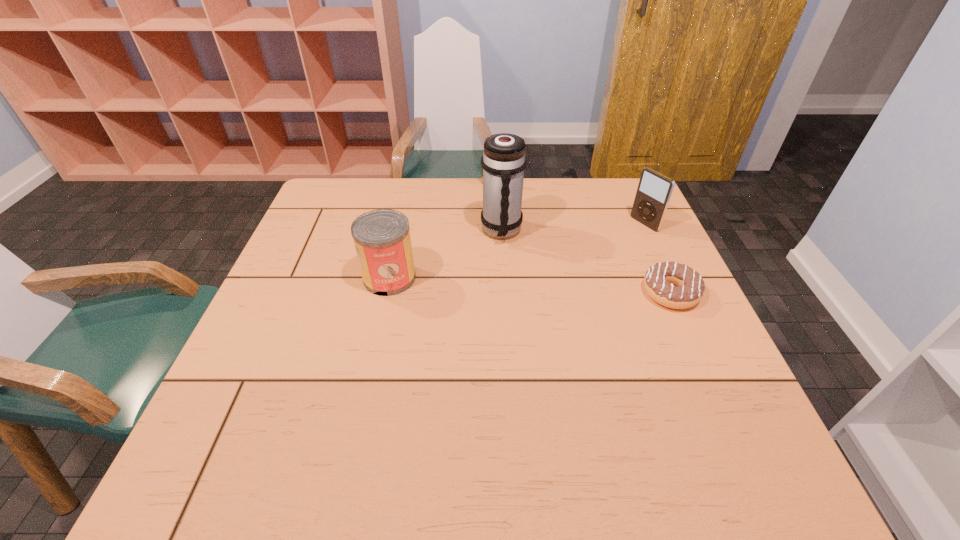
At what (x,y) coordinates should I click in order to perform the action: click on free space on the desktop that is between the can and the doughnut and is positioned on the side with the handle of the tallest object. Please return your answer as a coordinate pair (x, y). The width and height of the screenshot is (960, 540). Looking at the image, I should click on (525, 285).

Where is `vacant space on the desktop that is between the can and the shortest object and is positioned on the front-facing side of the iPod`? Image resolution: width=960 pixels, height=540 pixels. vacant space on the desktop that is between the can and the shortest object and is positioned on the front-facing side of the iPod is located at coordinates (528, 285).

What are the coordinates of `free space on the desktop that is between the can and the doughnut and is positioned on the side with the combination dials of the farthest object` in the screenshot? It's located at (556, 287).